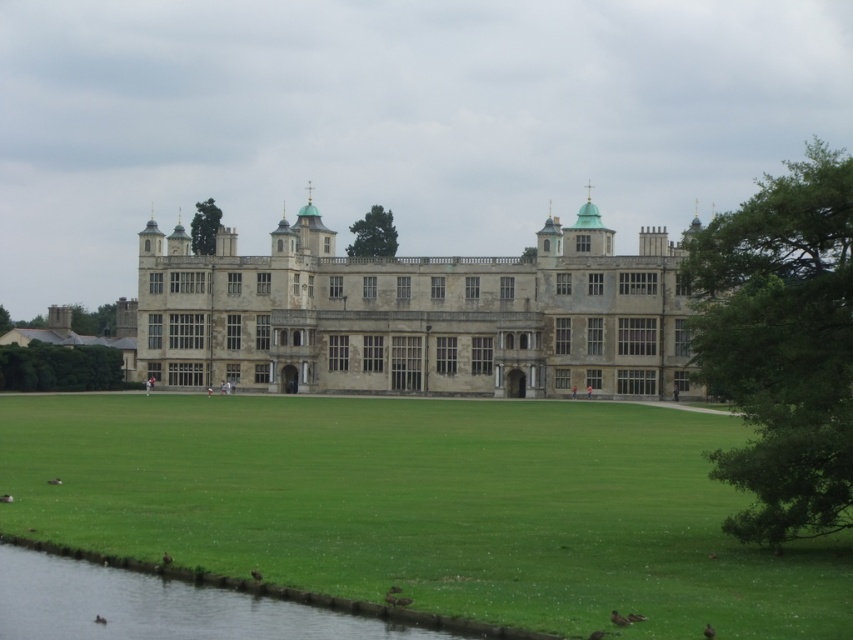
You are planning to set up a picnic blanket on the green grass at center or the green grassy river at lower left. Which area would be more suitable for a stable setup, and why?

The green grass at center is more suitable for a stable setup because it has a greater height compared to the green grassy river at lower left, making it firmer and less prone to being soggy from the water nearby.

You are standing at the edge of the green grass at center. Looking towards the historic building, which direction would you face?

Since the green grass at center is located at point (425,506) in the image, facing the historic building would mean looking towards the north direction.

You are standing on the green grass at center and want to walk to the green grassy river at lower left. Which direction should you move to reach the river?

The green grass at center is in front of the green grassy river at lower left, so you should move backward to reach the river.